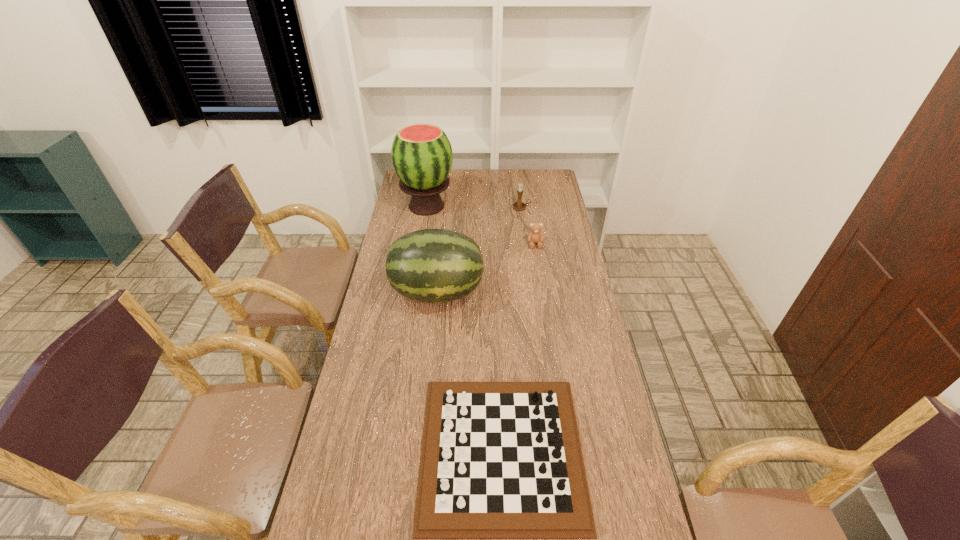
I want to click on vacant point that satisfies the following two spatial constraints: 1. on the front side of the taller watermelon; 2. on the left side of the shortest object, so click(387, 450).